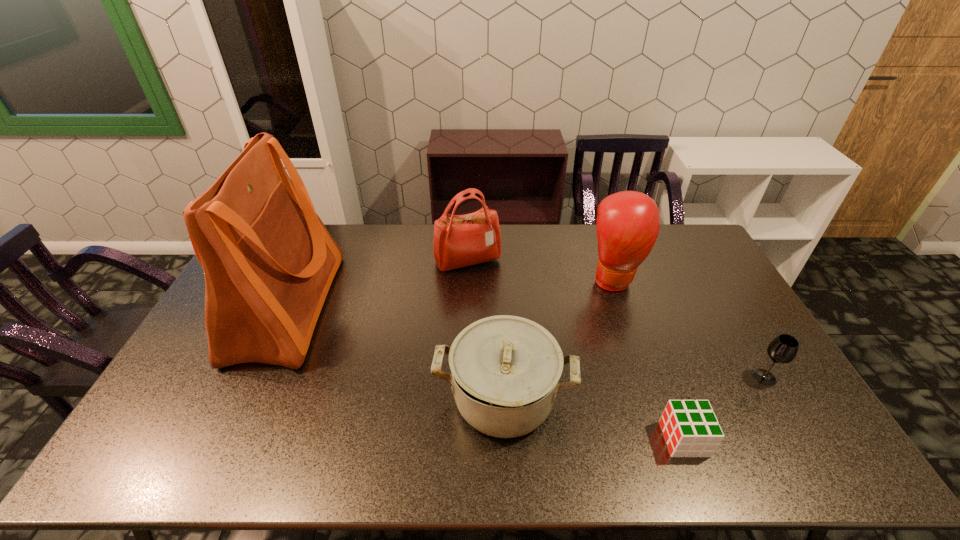
Identify the location of free space that is in between the boxing glove and the saucepan. (559, 339).

The width and height of the screenshot is (960, 540). I want to click on free spot between the cube and the boxing glove, so click(649, 359).

Identify the location of vacant space that's between the boxing glove and the tallest object. (450, 293).

This screenshot has height=540, width=960. I want to click on vacant space in between the cube and the fifth tallest object, so click(x=724, y=408).

Where is `unoccupied area between the shopping bag and the handbag`? unoccupied area between the shopping bag and the handbag is located at coordinates (377, 284).

At what (x,y) coordinates should I click in order to perform the action: click on free space between the rightmost object and the boxing glove. Please return your answer as a coordinate pair (x, y). Looking at the image, I should click on (689, 328).

At what (x,y) coordinates should I click in order to perform the action: click on the third closest object to the saucepan. Please return your answer as a coordinate pair (x, y). The width and height of the screenshot is (960, 540). Looking at the image, I should click on [459, 240].

Choose which object is the nearest neighbor to the third shortest object. Please provide its 2D coordinates. Your answer should be formatted as a tuple, i.e. [(x, y)], where the tuple contains the x and y coordinates of a point satisfying the conditions above.

[(690, 428)]

What are the coordinates of `free location that satisfies the following two spatial constraints: 1. on the striking surface of the fifth tallest object; 2. on the right side of the boxing glove` in the screenshot? It's located at pyautogui.click(x=648, y=377).

You are a GUI agent. You are given a task and a screenshot of the screen. Output one action in this format:
    pyautogui.click(x=<x>, y=<y>)
    Task: Click on the vacant position in the image that satisfies the following two spatial constraints: 1. on the front pocket of the fifth tallest object; 2. on the right side of the leftmost object
    The image size is (960, 540).
    Given the screenshot: What is the action you would take?
    pyautogui.click(x=254, y=377)